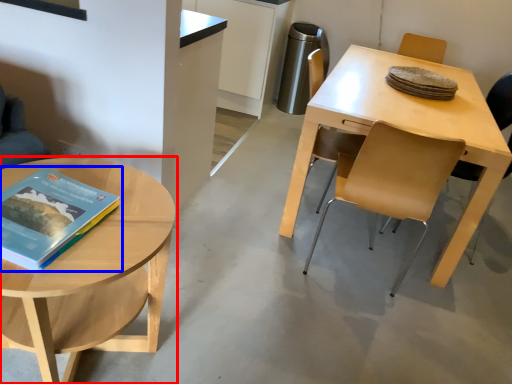
Question: Which of the following is the closest to the observer, coffee table (highlighted by a red box) or book (highlighted by a blue box)?

Choices:
 (A) coffee table
 (B) book

Answer: (A)